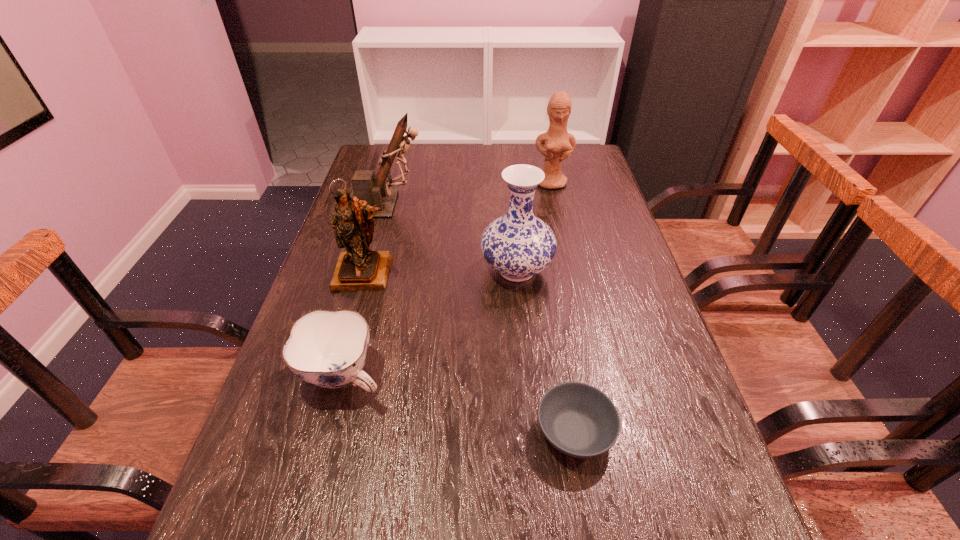
You are a GUI agent. You are given a task and a screenshot of the screen. Output one action in this format:
    pyautogui.click(x=<x>, y=<y>)
    Task: Click on the object that is at the far edge
    
    Given the screenshot: What is the action you would take?
    [x=559, y=144]

You are a GUI agent. You are given a task and a screenshot of the screen. Output one action in this format:
    pyautogui.click(x=<x>, y=<y>)
    Task: Click on the chinaware at the left edge
    The height and width of the screenshot is (540, 960).
    Given the screenshot: What is the action you would take?
    pyautogui.click(x=328, y=349)

Locate an element on the screen. The height and width of the screenshot is (540, 960). figurine positioned at the right edge is located at coordinates (559, 144).

This screenshot has width=960, height=540. I want to click on soup bowl positioned at the right edge, so 579,420.

The image size is (960, 540). What are the coordinates of `object that is at the far right corner` in the screenshot? It's located at (559, 144).

Find the location of a particular element. free region at the far edge of the desktop is located at coordinates (539, 154).

Image resolution: width=960 pixels, height=540 pixels. I want to click on vacant space at the left edge of the desktop, so tap(302, 463).

In the image, there is a desktop. What are the coordinates of `vacant space at the right edge` in the screenshot? It's located at (559, 195).

Locate an element on the screen. The width and height of the screenshot is (960, 540). free point at the far right corner is located at coordinates (582, 170).

At what (x,y) coordinates should I click in order to perform the action: click on free space between the chinaware and the rightmost figurine. Please return your answer as a coordinate pair (x, y). Looking at the image, I should click on (447, 279).